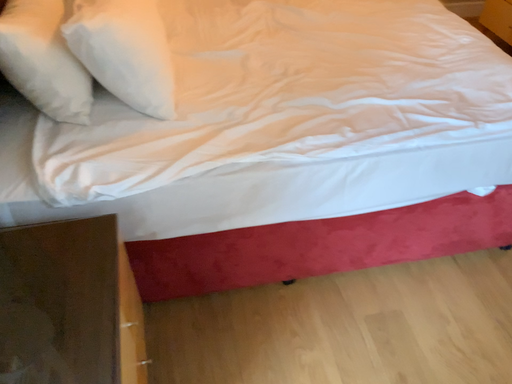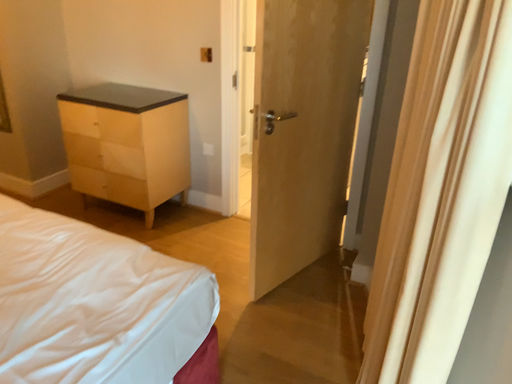
Question: Which way did the camera rotate in the video?

Choices:
 (A) rotated downward
 (B) rotated upward

Answer: (B)